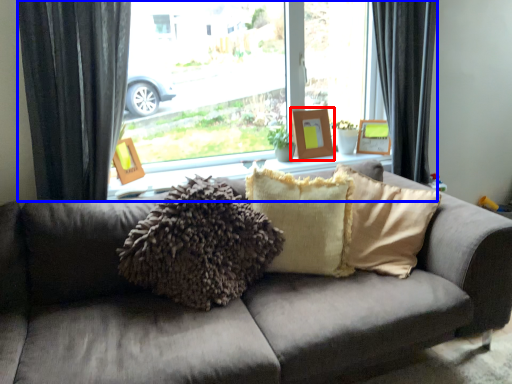
Question: Which point is closer to the camera, picture frame (highlighted by a red box) or window (highlighted by a blue box)?

Choices:
 (A) picture frame
 (B) window

Answer: (B)